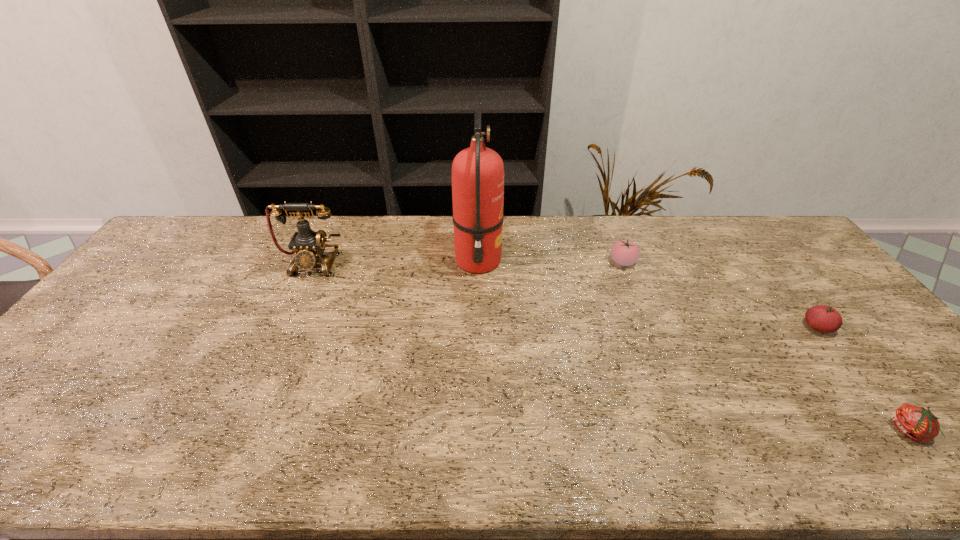
You are a GUI agent. You are given a task and a screenshot of the screen. Output one action in this format:
    pyautogui.click(x=<x>, y=<y>)
    Task: Click on the free location located 0.140m on the front of the leftmost object, featuring the rotary dial
    The image size is (960, 540).
    Given the screenshot: What is the action you would take?
    pyautogui.click(x=292, y=311)

The image size is (960, 540). I want to click on free space located on the front of the third object from left to right, so click(x=663, y=367).

I want to click on vacant space located 0.260m on the front of the second farthest tomato, so click(895, 426).

The height and width of the screenshot is (540, 960). What are the coordinates of `free spot located 0.190m on the back of the nearest object` in the screenshot? It's located at (844, 349).

The width and height of the screenshot is (960, 540). What are the coordinates of `fire extinguisher that is at the far edge` in the screenshot? It's located at (x=477, y=172).

Identify the location of telephone that is at the far edge. (309, 246).

Find the location of a particular element. tomato situated at the far edge is located at coordinates 624,252.

Image resolution: width=960 pixels, height=540 pixels. Identify the location of object located at the near edge. (917, 423).

Find the location of a particular element. Image resolution: width=960 pixels, height=540 pixels. object situated at the near right corner is located at coordinates (917, 423).

In the image, there is a desktop. Identify the location of vacant space at the far edge. The height and width of the screenshot is (540, 960). (649, 231).